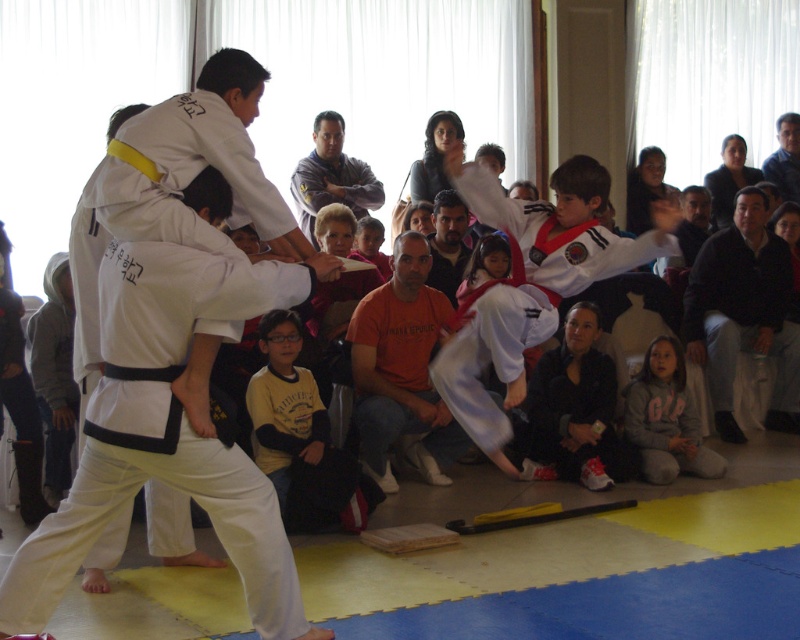
Question: Which of these objects is positioned farthest from the yellow long-sleeve shirt at lower center?

Choices:
 (A) white matte karate gi at center
 (B) dark hair at upper right
 (C) blue fabric shirt at upper right
 (D) orange cotton t-shirt at center

Answer: (C)

Question: Which point is closer to the camera?

Choices:
 (A) white matte karate gi at center
 (B) orange cotton t-shirt at center

Answer: (A)

Question: Can you confirm if black cotton shirt at upper right is smaller than white cotton shirt at lower center?

Choices:
 (A) no
 (B) yes

Answer: (A)

Question: Can you confirm if white matte karate gi at center is positioned above orange cotton shirt at center?

Choices:
 (A) no
 (B) yes

Answer: (A)

Question: Which is nearer to the blue fabric shirt at upper right?

Choices:
 (A) white matte karate gi at center
 (B) dark gray sweater at center
 (C) white cotton shirt at lower center
 (D) black cotton shirt at upper right

Answer: (D)

Question: Is orange cotton shirt at center behind dark hair at upper right?

Choices:
 (A) yes
 (B) no

Answer: (B)